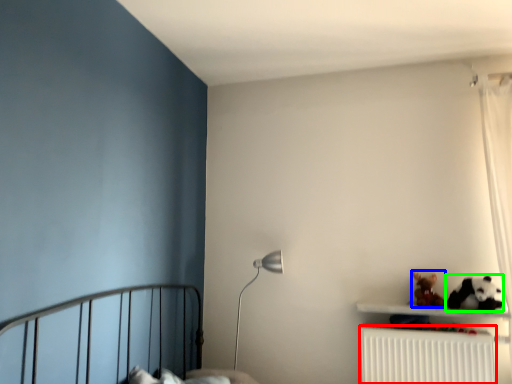
Question: Which object is positioned farthest from radiator (highlighted by a red box)? Select from toy (highlighted by a blue box) and animal (highlighted by a green box).

Choices:
 (A) toy
 (B) animal

Answer: (B)